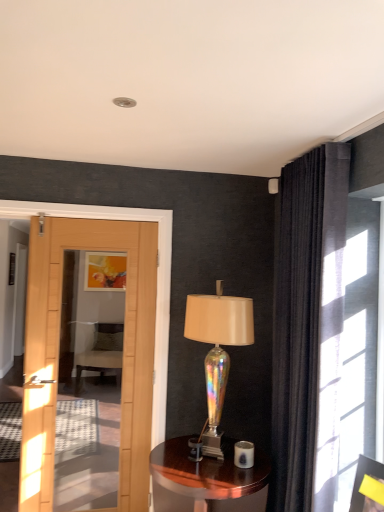
This screenshot has width=384, height=512. Describe the element at coordinates (206, 480) in the screenshot. I see `shiny brown wood side table at center` at that location.

The height and width of the screenshot is (512, 384). What are the coordinates of `velvet green chair at center` in the screenshot? It's located at (101, 351).

Where is `yellow paper at upper right, acting as the first picture frame starting from the bottom`? yellow paper at upper right, acting as the first picture frame starting from the bottom is located at coordinates (361, 483).

From the picture: Could you tell me if yellow paper at upper right, the second picture frame from the top, is facing velvet green chair at center?

No.

How different are the orientations of yellow paper at upper right, acting as the first picture frame starting from the front, and velvet green chair at center in degrees?

37.4 degrees separate the facing orientations of yellow paper at upper right, acting as the first picture frame starting from the front, and velvet green chair at center.

Where is `picture frame in front of the velvet green chair at center`? picture frame in front of the velvet green chair at center is located at coordinates (361, 483).

Is matte yellow picture frame at upper center, the second picture frame viewed from the front, to the left or to the right of yellow paper at upper right, the 2th picture frame in the left-to-right sequence, in the image?

matte yellow picture frame at upper center, the second picture frame viewed from the front, is to the left of yellow paper at upper right, the 2th picture frame in the left-to-right sequence.

Is matte yellow picture frame at upper center, the second picture frame viewed from the front, turned away from yellow paper at upper right, the second picture frame from the back?

No, matte yellow picture frame at upper center, the second picture frame viewed from the front, is not facing away from yellow paper at upper right, the second picture frame from the back.

Which of these two, matte yellow picture frame at upper center, the second picture frame viewed from the front, or yellow paper at upper right, the second picture frame from the back, stands shorter?

Standing shorter between the two is yellow paper at upper right, the second picture frame from the back.

From the image's perspective, between velvet green chair at center and yellow paper at upper right, acting as the first picture frame starting from the right, which one is located above?

yellow paper at upper right, acting as the first picture frame starting from the right, appears higher in the image.

Considering the sizes of objects velvet green chair at center and yellow paper at upper right, acting as the first picture frame starting from the right, in the image provided, who is shorter, velvet green chair at center or yellow paper at upper right, acting as the first picture frame starting from the right,?

Standing shorter between the two is yellow paper at upper right, acting as the first picture frame starting from the right.

How many degrees apart are the facing directions of velvet green chair at center and yellow paper at upper right, the second picture frame from the back?

The angle between the facing direction of velvet green chair at center and the facing direction of yellow paper at upper right, the second picture frame from the back, is 37.4 degrees.

Is velvet green chair at center turned away from yellow paper at upper right, acting as the first picture frame starting from the right?

That's not correct — velvet green chair at center is not looking away from yellow paper at upper right, acting as the first picture frame starting from the right.

In the scene shown: Is matte yellow picture frame at upper center, acting as the 2th picture frame starting from the right, with dark velvet curtain at upper right?

No.

Who is bigger, matte yellow picture frame at upper center, the second picture frame viewed from the front, or dark velvet curtain at upper right?

Bigger between the two is dark velvet curtain at upper right.

Considering the relative sizes of matte yellow picture frame at upper center, the 2th picture frame in the bottom-to-top sequence, and dark velvet curtain at upper right in the image provided, is matte yellow picture frame at upper center, the 2th picture frame in the bottom-to-top sequence, thinner than dark velvet curtain at upper right?

Indeed, matte yellow picture frame at upper center, the 2th picture frame in the bottom-to-top sequence, has a lesser width compared to dark velvet curtain at upper right.

Can you tell me how much matte yellow picture frame at upper center, positioned as the 1th picture frame in top-to-bottom order, and dark velvet curtain at upper right differ in facing direction?

The facing directions of matte yellow picture frame at upper center, positioned as the 1th picture frame in top-to-bottom order, and dark velvet curtain at upper right are 93 degrees apart.

Is iridescent glass lamp at center to the left of dark velvet curtain at upper right from the viewer's perspective?

Yes, iridescent glass lamp at center is to the left of dark velvet curtain at upper right.

From a real-world perspective, is iridescent glass lamp at center physically above dark velvet curtain at upper right?

No.

From the image's perspective, which object appears higher, iridescent glass lamp at center or dark velvet curtain at upper right?

dark velvet curtain at upper right.

Find the location of a particular element. The width and height of the screenshot is (384, 512). curtain lying on the right of iridescent glass lamp at center is located at coordinates (305, 318).

Is the depth of yellow paper at upper right, the second picture frame from the back, greater than that of iridescent glass lamp at center?

No.

Between yellow paper at upper right, the second picture frame from the back, and iridescent glass lamp at center, which one has less height?

yellow paper at upper right, the second picture frame from the back, is shorter.

Is iridescent glass lamp at center at the back of yellow paper at upper right, the second picture frame from the top?

yellow paper at upper right, the second picture frame from the top, is not turned away from iridescent glass lamp at center.

Is yellow paper at upper right, acting as the first picture frame starting from the front, placed right next to iridescent glass lamp at center?

yellow paper at upper right, acting as the first picture frame starting from the front, is not next to iridescent glass lamp at center, and they're not touching.

Which object is positioned more to the left, velvet green chair at center or dark velvet curtain at upper right?

Positioned to the left is velvet green chair at center.

Looking at the image, does velvet green chair at center seem bigger or smaller compared to dark velvet curtain at upper right?

velvet green chair at center is bigger than dark velvet curtain at upper right.

Is velvet green chair at center located outside dark velvet curtain at upper right?

Absolutely, velvet green chair at center is external to dark velvet curtain at upper right.

Which object is further away from the camera taking this photo, velvet green chair at center or dark velvet curtain at upper right?

velvet green chair at center.

Image resolution: width=384 pixels, height=512 pixels. Identify the location of the 1st picture frame located above the velvet green chair at center (from a real-world perspective). (361, 483).

Locate an element on the screen. Image resolution: width=384 pixels, height=512 pixels. picture frame lying in front of the matte yellow picture frame at upper center, acting as the 1th picture frame starting from the left is located at coordinates (361, 483).

Looking at the image, which one is located closer to matte yellow picture frame at upper center, positioned as the 1th picture frame in top-to-bottom order, iridescent glass lamp at center or yellow paper at upper right, the second picture frame from the back?

Based on the image, iridescent glass lamp at center appears to be nearer to matte yellow picture frame at upper center, positioned as the 1th picture frame in top-to-bottom order.

When comparing their distances from yellow paper at upper right, the second picture frame from the back, does matte yellow picture frame at upper center, the second picture frame viewed from the front, or velvet green chair at center seem closer?

The object closer to yellow paper at upper right, the second picture frame from the back, is velvet green chair at center.

Estimate the real-world distances between objects in this image. Which object is further from velvet green chair at center, yellow paper at upper right, acting as the first picture frame starting from the front, or dark velvet curtain at upper right?

yellow paper at upper right, acting as the first picture frame starting from the front, lies further to velvet green chair at center than the other object.

Which object lies nearer to the anchor point shiny brown wood side table at center, matte yellow picture frame at upper center, arranged as the first picture frame when viewed from the back, or velvet green chair at center?

velvet green chair at center.

When comparing their distances from velvet green chair at center, does yellow paper at upper right, the second picture frame from the back, or iridescent glass lamp at center seem further?

yellow paper at upper right, the second picture frame from the back, lies further to velvet green chair at center than the other object.

Estimate the real-world distances between objects in this image. Which object is further from dark velvet curtain at upper right, iridescent glass lamp at center or yellow paper at upper right, acting as the first picture frame starting from the bottom?

The object further to dark velvet curtain at upper right is yellow paper at upper right, acting as the first picture frame starting from the bottom.

Which object lies further to the anchor point velvet green chair at center, matte yellow picture frame at upper center, arranged as the first picture frame when viewed from the back, or yellow paper at upper right, the second picture frame from the top?

The object further to velvet green chair at center is yellow paper at upper right, the second picture frame from the top.

In the scene shown: Estimate the real-world distances between objects in this image. Which object is further from yellow paper at upper right, the 2th picture frame in the left-to-right sequence, velvet green chair at center or matte yellow picture frame at upper center, acting as the 1th picture frame starting from the left?

The object further to yellow paper at upper right, the 2th picture frame in the left-to-right sequence, is matte yellow picture frame at upper center, acting as the 1th picture frame starting from the left.

This screenshot has height=512, width=384. What are the coordinates of `lamp positioned between yellow paper at upper right, acting as the first picture frame starting from the right, and velvet green chair at center from near to far` in the screenshot? It's located at (218, 349).

Locate an element on the screen. picture frame that lies between dark velvet curtain at upper right and shiny brown wood side table at center from top to bottom is located at coordinates (361, 483).

Image resolution: width=384 pixels, height=512 pixels. Find the location of `lamp located between shiny brown wood side table at center and matte yellow picture frame at upper center, the 2th picture frame in the bottom-to-top sequence, in the depth direction`. lamp located between shiny brown wood side table at center and matte yellow picture frame at upper center, the 2th picture frame in the bottom-to-top sequence, in the depth direction is located at coordinates (218, 349).

Locate an element on the screen. lamp between dark velvet curtain at upper right and matte yellow picture frame at upper center, the second picture frame viewed from the front, from front to back is located at coordinates (218, 349).